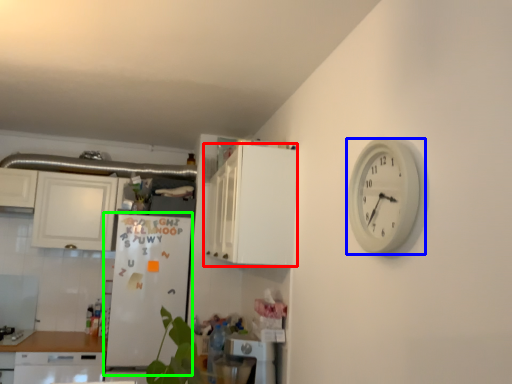
Question: Considering the real-world distances, which object is closest to cabinetry (highlighted by a red box)? wall clock (highlighted by a blue box) or fridge (highlighted by a green box).

Choices:
 (A) wall clock
 (B) fridge

Answer: (A)